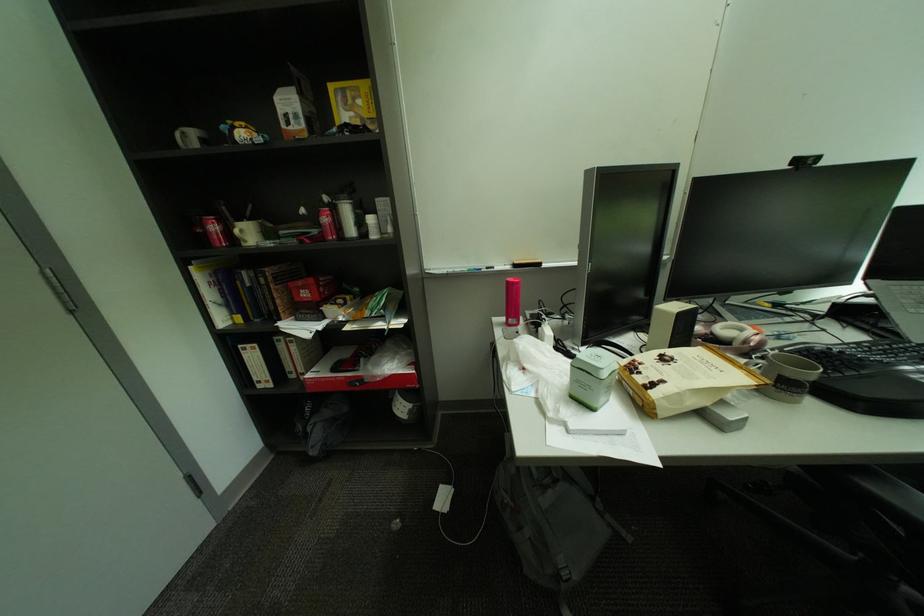
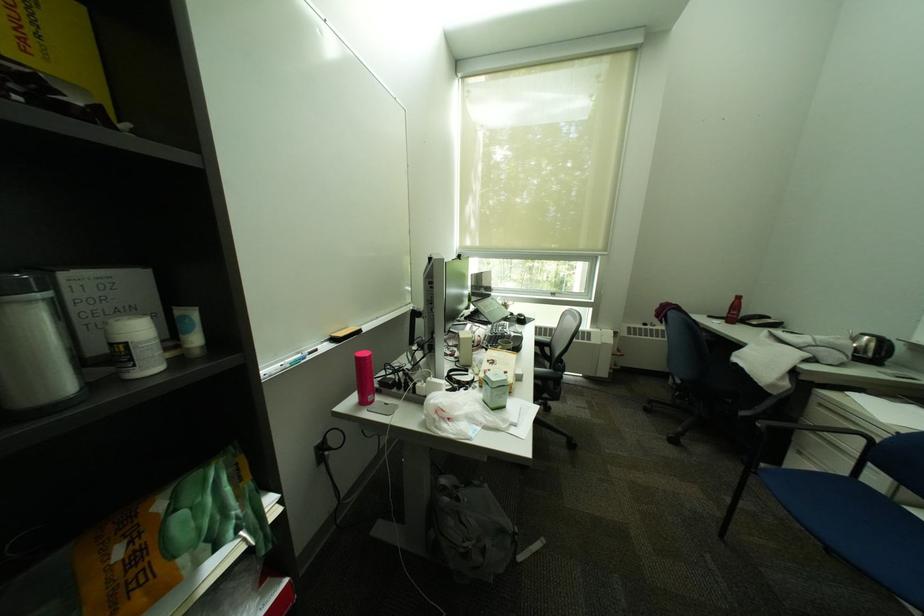
Question: How did the camera likely rotate?

Choices:
 (A) Left
 (B) Right
 (C) Up
 (D) Down

Answer: (B)